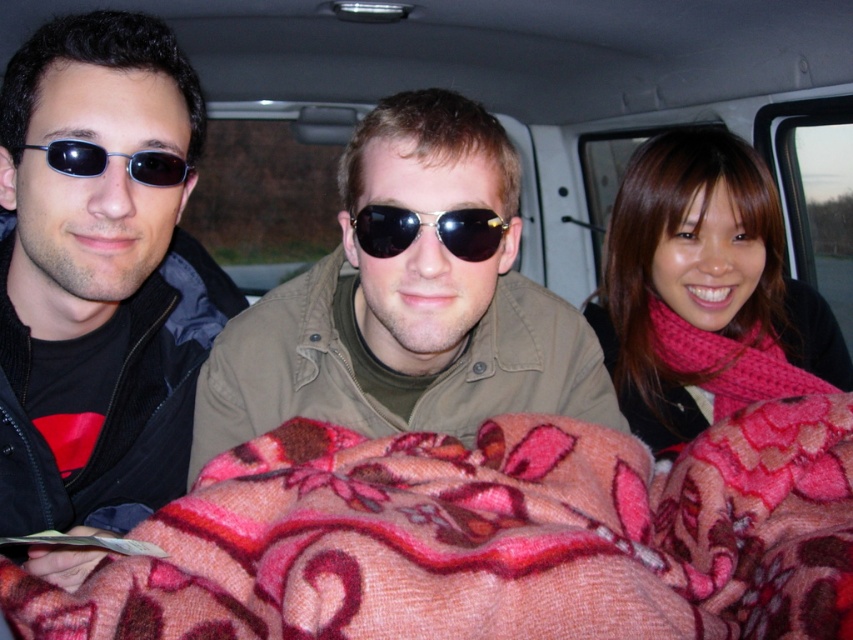
You are inside a van and need to locate the pink knitted scarf at upper right. According to the coordinates provided, where exactly is it positioned?

The pink knitted scarf at upper right is located at point [705,291], which means it is positioned near the upper right area of the van interior.

You are standing 3 feet away from the van. You want to touch the point at coordinates point (624, 440). Can you reach it without moving closer?

The point at coordinates point (624, 440) is 3.44 feet away from you. Since you are only 3 feet away from the van, you cannot reach the point without moving closer because the distance to the point is greater than your current distance from the van.